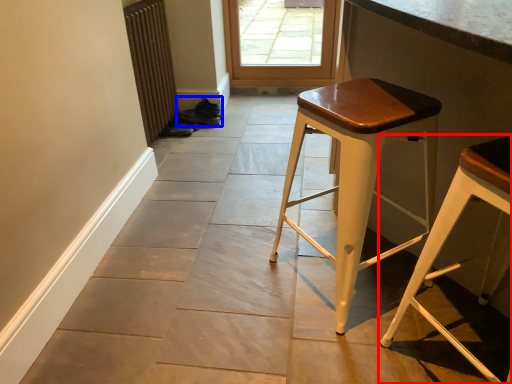
Question: Among these objects, which one is nearest to the camera, stool (highlighted by a red box) or shoe (highlighted by a blue box)?

Choices:
 (A) stool
 (B) shoe

Answer: (A)